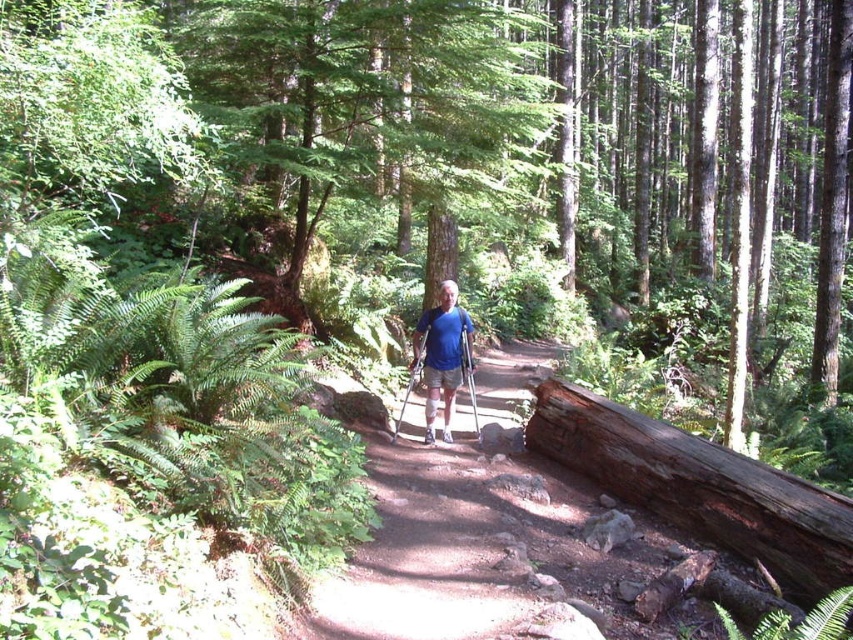
You are hiking on a forest trail and see the weathered brown log at right and the blue fabric shirt at center. Which object is nearer to you?

The weathered brown log at right is closer to the viewer than the blue fabric shirt at center.

You are hiking along the forest trail and notice the weathered brown log at right and the blue fabric shirt at center. Which object is positioned lower in the scene?

The weathered brown log at right is located below the blue fabric shirt at center, so it is positioned lower in the scene.

You are a hiker carrying a backpack and see the weathered brown log at right and the blue fabric shirt at center in your path. Which object is wider?

The weathered brown log at right is wider than the blue fabric shirt at center.